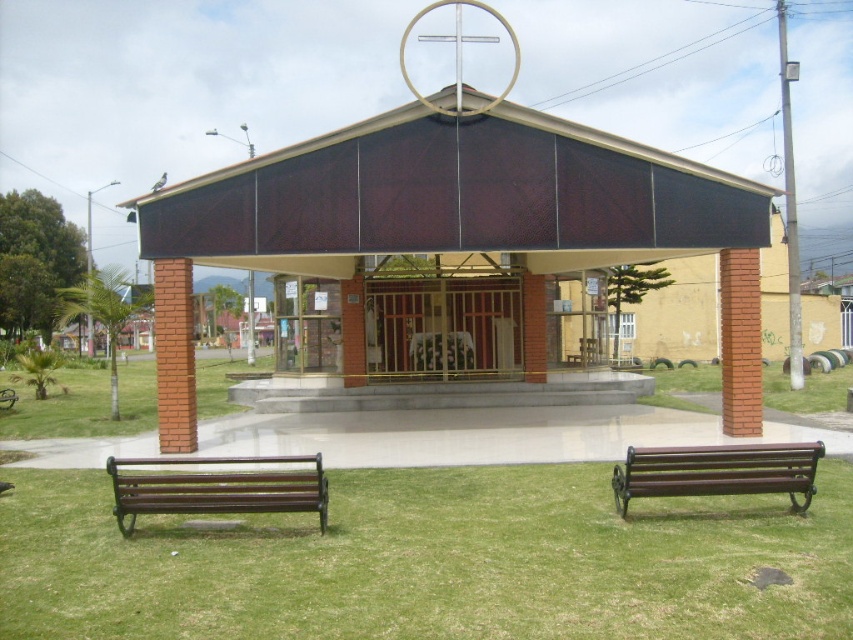
Is matte brown chapel at center bigger than brown polished wood bench at lower left?

Indeed, matte brown chapel at center has a larger size compared to brown polished wood bench at lower left.

Is matte brown chapel at center in front of brown polished wood bench at lower left?

No, matte brown chapel at center is behind brown polished wood bench at lower left.

Describe the element at coordinates (454, 225) in the screenshot. I see `matte brown chapel at center` at that location.

The width and height of the screenshot is (853, 640). What are the coordinates of `matte brown chapel at center` in the screenshot? It's located at (454, 225).

The height and width of the screenshot is (640, 853). What do you see at coordinates (428, 561) in the screenshot?
I see `green grass at lower center` at bounding box center [428, 561].

Is point (267, 595) behind point (787, 488)?

No, (267, 595) is closer to viewer.

The width and height of the screenshot is (853, 640). Identify the location of green grass at lower center. (428, 561).

Does green grass at lower center have a lesser height compared to metallic gate at center?

Indeed, green grass at lower center has a lesser height compared to metallic gate at center.

Can you confirm if green grass at lower center is taller than metallic gate at center?

Incorrect, green grass at lower center's height is not larger of metallic gate at center's.

Which is in front, point (358, 586) or point (413, 371)?

Point (358, 586)

You are a GUI agent. You are given a task and a screenshot of the screen. Output one action in this format:
    pyautogui.click(x=<x>, y=<y>)
    Task: Click on the green grass at lower center
    This screenshot has width=853, height=640.
    Given the screenshot: What is the action you would take?
    pyautogui.click(x=428, y=561)